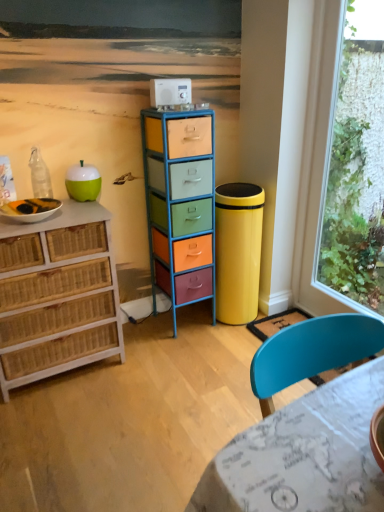
This screenshot has height=512, width=384. In order to click on free space in front of metallic multicolored drawers at center, placed as the 1th chest of drawers when sorted from right to left in this screenshot , I will do `click(183, 351)`.